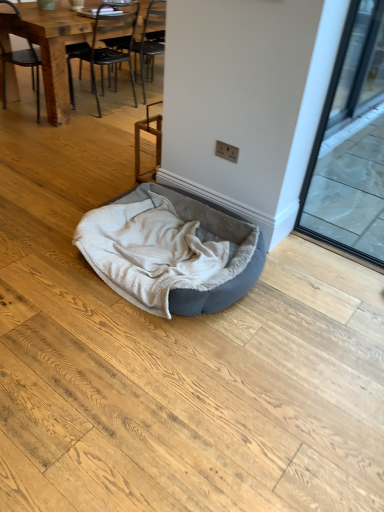
The image size is (384, 512). Describe the element at coordinates (350, 146) in the screenshot. I see `transparent glass screen door at right` at that location.

Image resolution: width=384 pixels, height=512 pixels. Describe the element at coordinates (169, 251) in the screenshot. I see `velvet grey dog bed at center` at that location.

Measure the distance between black metal chair at upper left, the second chair in the left-to-right sequence, and camera.

A distance of 3.36 meters exists between black metal chair at upper left, the second chair in the left-to-right sequence, and camera.

The image size is (384, 512). I want to click on transparent glass screen door at right, so click(x=350, y=146).

Are wooden chair at left, the first chair viewed from the left, and velvet grey dog bed at center far apart?

Yes, wooden chair at left, the first chair viewed from the left, is far from velvet grey dog bed at center.

Based on the photo, from a real-world perspective, who is located higher, wooden chair at left, the first chair viewed from the left, or velvet grey dog bed at center?

From a 3D spatial view, wooden chair at left, the first chair viewed from the left, is above.

Locate an element on the screen. This screenshot has height=512, width=384. chair that is the 1st object located above the velvet grey dog bed at center (from the image's perspective) is located at coordinates (55, 52).

Considering the relative sizes of wooden chair at left, acting as the 2th chair starting from the right, and transparent glass screen door at right in the image provided, is wooden chair at left, acting as the 2th chair starting from the right, thinner than transparent glass screen door at right?

No.

Which object is positioned more to the right, wooden chair at left, acting as the 2th chair starting from the right, or transparent glass screen door at right?

transparent glass screen door at right.

From the image's perspective, which is above, wooden chair at left, acting as the 2th chair starting from the right, or transparent glass screen door at right?

wooden chair at left, acting as the 2th chair starting from the right.

How much distance is there between wooden chair at left, acting as the 2th chair starting from the right, and transparent glass screen door at right?

The distance of wooden chair at left, acting as the 2th chair starting from the right, from transparent glass screen door at right is 2.33 meters.

Is black metal chair at upper left, the second chair in the left-to-right sequence, inside the boundaries of transparent glass screen door at right, or outside?

black metal chair at upper left, the second chair in the left-to-right sequence, exists outside the volume of transparent glass screen door at right.

This screenshot has width=384, height=512. I want to click on screen door above the black metal chair at upper left, the first chair in the right-to-left sequence (from a real-world perspective), so click(x=350, y=146).

Is point (106, 49) positioned behind point (381, 241)?

Yes, point (106, 49) is behind point (381, 241).

Looking at this image, does black metal chair at upper left, the first chair in the right-to-left sequence, have a greater width compared to transparent glass screen door at right?

Yes, black metal chair at upper left, the first chair in the right-to-left sequence, is wider than transparent glass screen door at right.

Would you say velvet grey dog bed at center is outside wooden chair at left, the first chair viewed from the left?

Yes.

Considering the sizes of velvet grey dog bed at center and wooden chair at left, the first chair viewed from the left, in the image, is velvet grey dog bed at center bigger or smaller than wooden chair at left, the first chair viewed from the left,?

velvet grey dog bed at center is smaller than wooden chair at left, the first chair viewed from the left.

Does velvet grey dog bed at center lie in front of wooden chair at left, acting as the 2th chair starting from the right?

Yes, it is.

From a real-world perspective, which object rests below the other?

wooden chair at left, the first chair viewed from the left, from a real-world perspective.

Could you tell me if transparent glass screen door at right is turned towards wooden chair at left, the first chair viewed from the left?

Answer: No, transparent glass screen door at right is not oriented towards wooden chair at left, the first chair viewed from the left.

Is point (310, 218) behind point (30, 28)?

No, it is in front of (30, 28).

Does transparent glass screen door at right have a greater width compared to wooden chair at left, acting as the 2th chair starting from the right?

No, transparent glass screen door at right is not wider than wooden chair at left, acting as the 2th chair starting from the right.

Which of these two, velvet grey dog bed at center or black metal chair at upper left, the first chair in the right-to-left sequence, is smaller?

With smaller size is velvet grey dog bed at center.

Considering the relative sizes of velvet grey dog bed at center and black metal chair at upper left, the second chair in the left-to-right sequence, in the image provided, is velvet grey dog bed at center thinner than black metal chair at upper left, the second chair in the left-to-right sequence,?

No.

Considering their positions, is velvet grey dog bed at center located in front of or behind black metal chair at upper left, the first chair in the right-to-left sequence?

In the image, velvet grey dog bed at center appears in front of black metal chair at upper left, the first chair in the right-to-left sequence.

Would you consider velvet grey dog bed at center to be distant from black metal chair at upper left, the first chair in the right-to-left sequence?

Absolutely, velvet grey dog bed at center is distant from black metal chair at upper left, the first chair in the right-to-left sequence.

Which is in front, point (356, 234) or point (80, 54)?

The point (356, 234) is closer to the camera.

Is transparent glass screen door at right in front of black metal chair at upper left, the second chair in the left-to-right sequence?

Yes, it is.

From the image's perspective, does transparent glass screen door at right appear lower than black metal chair at upper left, the first chair in the right-to-left sequence?

Yes.

From the velvet grey dog bed at center, count 1st chairs backward and point to it. Please provide its 2D coordinates.

[(55, 52)]

Find the location of `screen door in front of the wooden chair at left, acting as the 2th chair starting from the right`. screen door in front of the wooden chair at left, acting as the 2th chair starting from the right is located at coordinates (350, 146).

Which object lies further to the anchor point black metal chair at upper left, the first chair in the right-to-left sequence, velvet grey dog bed at center or wooden chair at left, the first chair viewed from the left?

velvet grey dog bed at center.

Looking at the image, which one is located closer to wooden chair at left, the first chair viewed from the left, transparent glass screen door at right or black metal chair at upper left, the second chair in the left-to-right sequence?

black metal chair at upper left, the second chair in the left-to-right sequence, is closer to wooden chair at left, the first chair viewed from the left.

Based on their spatial positions, is wooden chair at left, acting as the 2th chair starting from the right, or velvet grey dog bed at center further from black metal chair at upper left, the second chair in the left-to-right sequence?

velvet grey dog bed at center is further to black metal chair at upper left, the second chair in the left-to-right sequence.

From the image, which object appears to be nearer to velvet grey dog bed at center, black metal chair at upper left, the second chair in the left-to-right sequence, or wooden chair at left, acting as the 2th chair starting from the right?

Based on the image, wooden chair at left, acting as the 2th chair starting from the right, appears to be nearer to velvet grey dog bed at center.

When comparing their distances from velvet grey dog bed at center, does wooden chair at left, the first chair viewed from the left, or black metal chair at upper left, the first chair in the right-to-left sequence, seem closer?

wooden chair at left, the first chair viewed from the left.

Which object lies further to the anchor point wooden chair at left, the first chair viewed from the left, transparent glass screen door at right or velvet grey dog bed at center?

transparent glass screen door at right lies further to wooden chair at left, the first chair viewed from the left, than the other object.

Which object lies further to the anchor point wooden chair at left, acting as the 2th chair starting from the right, velvet grey dog bed at center or black metal chair at upper left, the second chair in the left-to-right sequence?

velvet grey dog bed at center lies further to wooden chair at left, acting as the 2th chair starting from the right, than the other object.

Which object lies nearer to the anchor point velvet grey dog bed at center, wooden chair at left, the first chair viewed from the left, or transparent glass screen door at right?

Among the two, transparent glass screen door at right is located nearer to velvet grey dog bed at center.

Find the location of a particular element. dog bed located between wooden chair at left, the first chair viewed from the left, and transparent glass screen door at right in the left-right direction is located at coordinates (169, 251).

You are a GUI agent. You are given a task and a screenshot of the screen. Output one action in this format:
    pyautogui.click(x=<x>, y=<y>)
    Task: Click on the chair between black metal chair at upper left, the first chair in the right-to-left sequence, and velvet grey dog bed at center from top to bottom
    
    Given the screenshot: What is the action you would take?
    pyautogui.click(x=55, y=52)

Identify the location of screen door between black metal chair at upper left, the first chair in the right-to-left sequence, and velvet grey dog bed at center, in the vertical direction. Image resolution: width=384 pixels, height=512 pixels. [x=350, y=146].

Where is `chair located between wooden chair at left, acting as the 2th chair starting from the right, and transparent glass screen door at right in the left-right direction`? This screenshot has width=384, height=512. chair located between wooden chair at left, acting as the 2th chair starting from the right, and transparent glass screen door at right in the left-right direction is located at coordinates (107, 45).